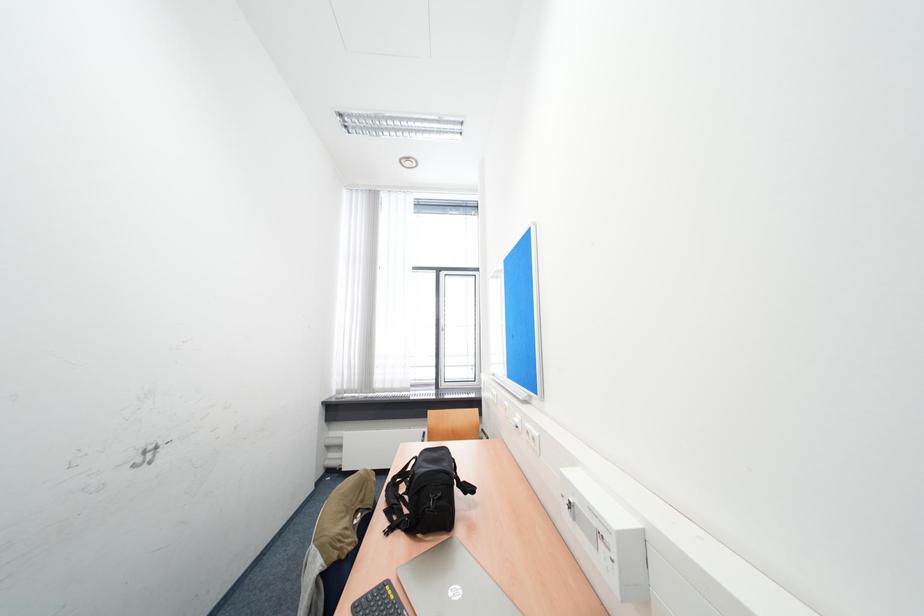
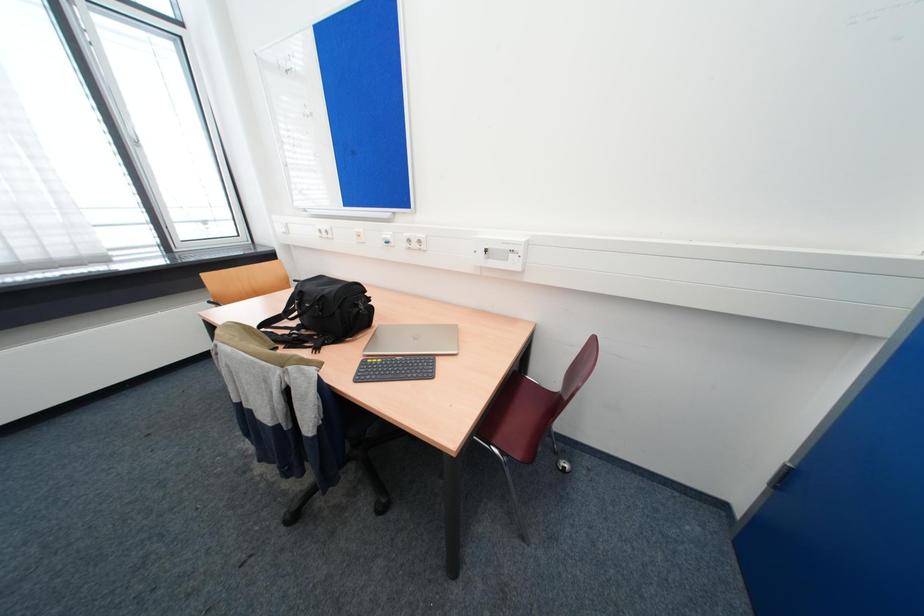
How did the camera likely rotate?

The rotation direction of the camera is right-down.